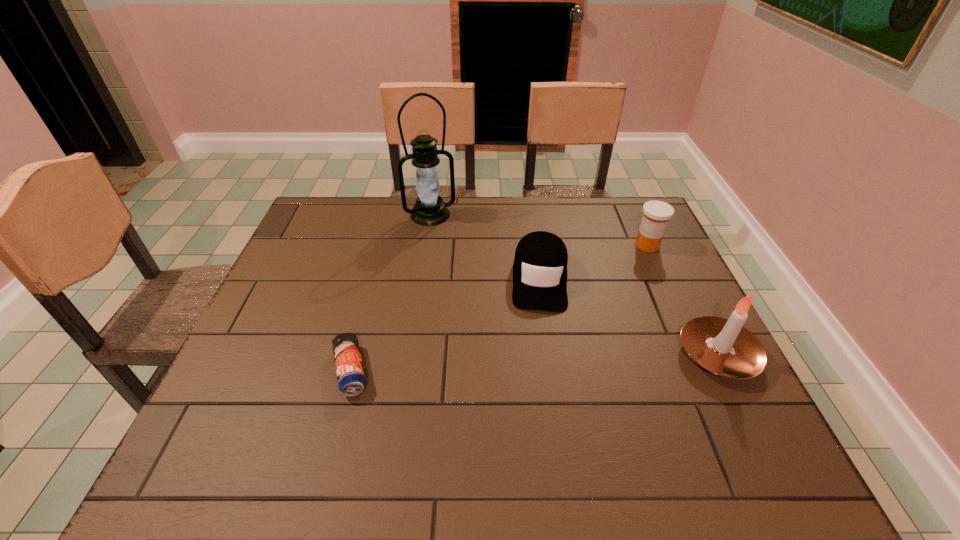
Where is `free space that is in between the beer can and the tallest object`? free space that is in between the beer can and the tallest object is located at coordinates (391, 293).

Point out which object is positioned as the second nearest to the farthest object. Please provide its 2D coordinates. Your answer should be formatted as a tuple, i.e. [(x, y)], where the tuple contains the x and y coordinates of a point satisfying the conditions above.

[(351, 379)]

Find the location of a particular element. The width and height of the screenshot is (960, 540). the closest object to the cap is located at coordinates tap(430, 209).

At what (x,y) coordinates should I click in order to perform the action: click on vacant space that satisfies the following two spatial constraints: 1. on the back side of the cap; 2. on the right side of the shortest object. Please return your answer as a coordinate pair (x, y). Looking at the image, I should click on (374, 279).

Locate an element on the screen. Image resolution: width=960 pixels, height=540 pixels. free space that satisfies the following two spatial constraints: 1. on the front side of the farthest object; 2. on the left side of the third object from right to left is located at coordinates coord(420,279).